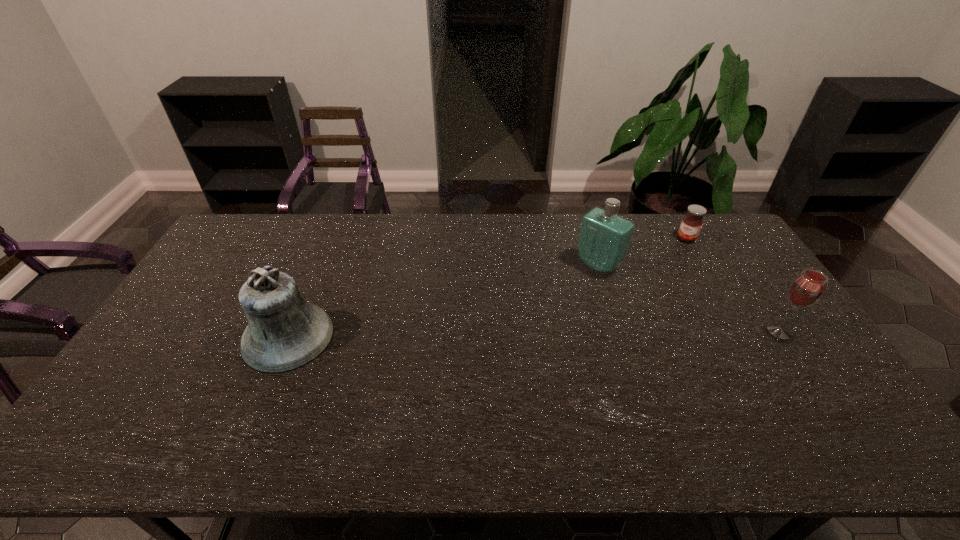
This screenshot has height=540, width=960. What are the coordinates of `free space on the desktop that is between the bell and the second shortest object and is positioned on the front label of the second object from left to right` in the screenshot? It's located at (521, 334).

Identify the location of free spot on the desktop that is between the leftmost object and the rightmost object and is positioned on the label side of the farthest object. (603, 333).